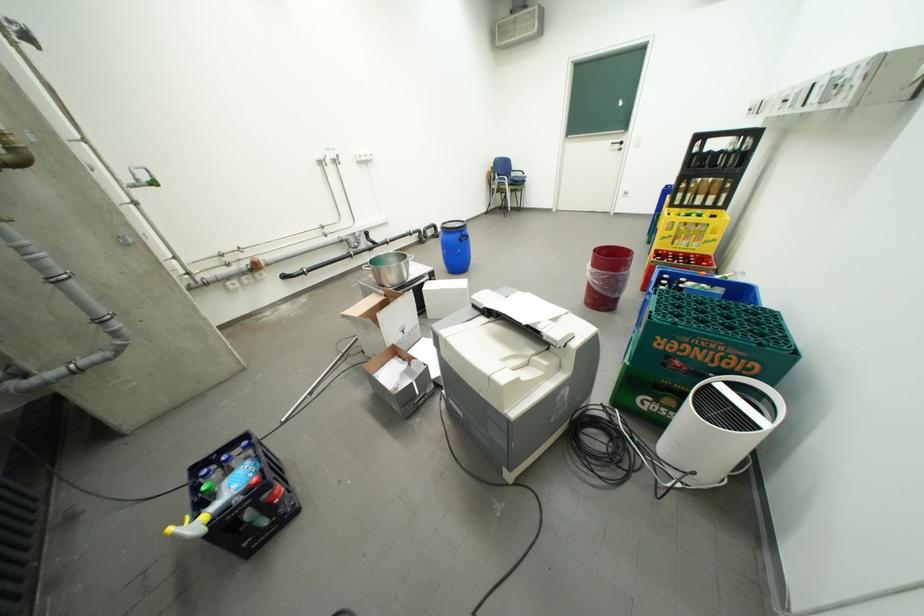
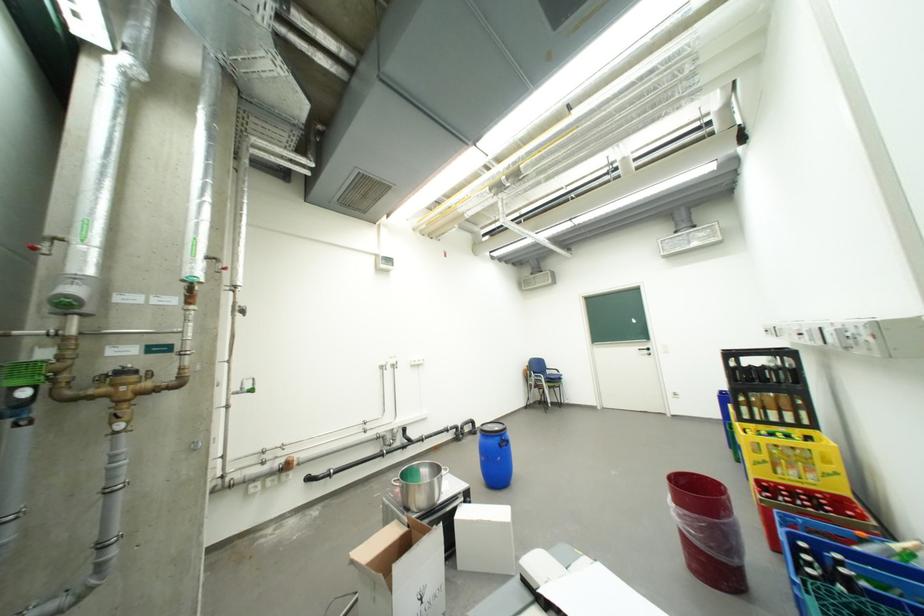
Find the pixel in the second image that matches (x=602, y=269) in the first image.

(685, 507)